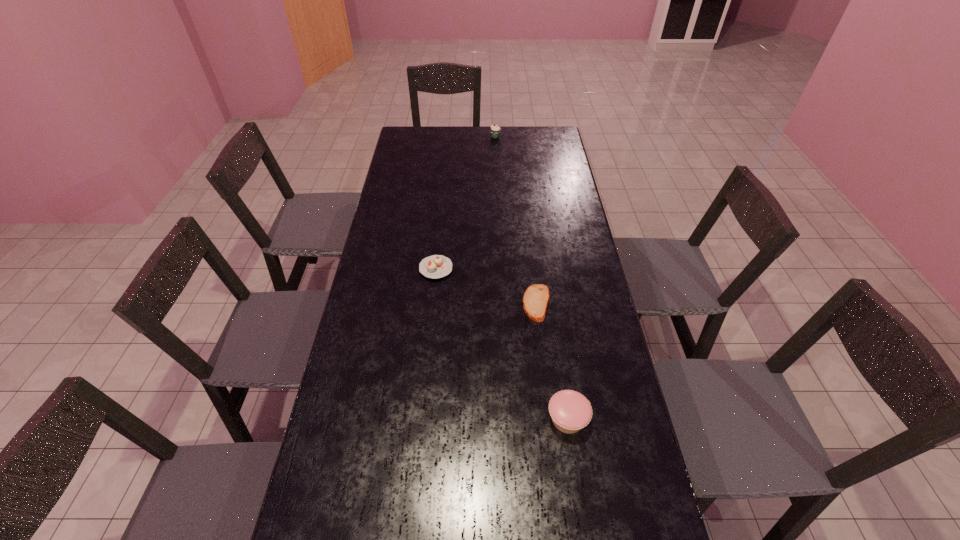
The image size is (960, 540). In order to click on the third object from right to left in this screenshot , I will do `click(495, 130)`.

This screenshot has height=540, width=960. I want to click on the tallest cupcake, so click(x=495, y=130).

Find the location of a particular element. Image resolution: width=960 pixels, height=540 pixels. the nearest object is located at coordinates (570, 411).

In order to click on the nearest cupcake in this screenshot , I will do `click(570, 411)`.

The width and height of the screenshot is (960, 540). Find the location of `the second shortest object`. the second shortest object is located at coordinates (436, 266).

This screenshot has width=960, height=540. Identify the location of the shortest cupcake. (436, 266).

The image size is (960, 540). Find the location of `pita bread`. pita bread is located at coordinates (536, 297).

The image size is (960, 540). Find the location of `the shortest object`. the shortest object is located at coordinates (536, 297).

This screenshot has width=960, height=540. I want to click on vacant space located 0.250m on the left of the tallest cupcake, so click(x=436, y=137).

Locate an element on the screen. The height and width of the screenshot is (540, 960). vacant position located 0.170m on the front of the second shortest cupcake is located at coordinates (582, 517).